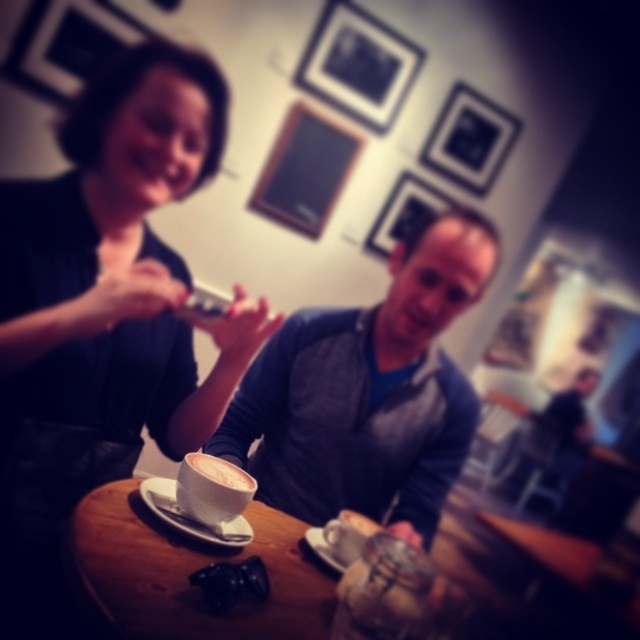
You are a photographer trying to capture a candid shot of the gray sweater at center without being noticed. The camera you are using has a minimum focusing distance of 1.0 meters. Can you take the photo from your current position?

The gray sweater at center and camera are 1.10 meters apart, so yes, you can take the photo from your current position since the distance is within the camera minimum focusing distance of 1.0 meters.

You are a barista trying to place the matte black coffee cup at upper center and the gray sweater at center on a shelf. The shelf has a height limit of 10 cm. Can both items fit vertically on the shelf?

The matte black coffee cup at upper center is taller than the gray sweater at center. Since the shelf has a height limit of 10 cm, if the coffee cup exceeds this height, it won